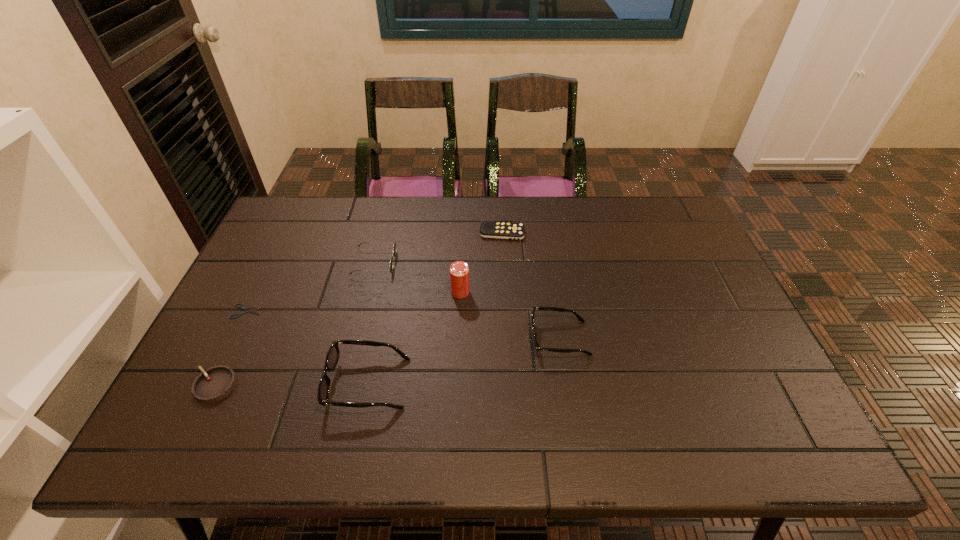
Where is `the sixth shortest object`? The height and width of the screenshot is (540, 960). the sixth shortest object is located at coordinates (332, 357).

Find the location of a particular element. The height and width of the screenshot is (540, 960). the taller spectacles is located at coordinates (332, 357).

What are the coordinates of `the fifth shortest object` in the screenshot? It's located at (537, 347).

I want to click on the shorter spectacles, so click(537, 347).

The width and height of the screenshot is (960, 540). What are the coordinates of `the sixth tallest object` in the screenshot? It's located at (501, 230).

This screenshot has width=960, height=540. What are the coordinates of `remote control` in the screenshot? It's located at (501, 230).

Where is `shears`? Image resolution: width=960 pixels, height=540 pixels. shears is located at coordinates (251, 311).

Where is `the sixth nearest object`? The image size is (960, 540). the sixth nearest object is located at coordinates (394, 246).

You are a GUI agent. You are given a task and a screenshot of the screen. Output one action in this format:
    pyautogui.click(x=<x>, y=<y>)
    Task: Click on the sunglasses
    The width and height of the screenshot is (960, 540).
    Given the screenshot: What is the action you would take?
    pyautogui.click(x=394, y=246)

Where is `the tallest object`? the tallest object is located at coordinates (459, 271).